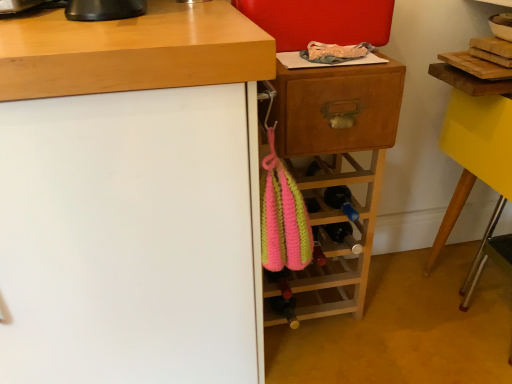
Locate an element on the screen. Image resolution: width=512 pixels, height=384 pixels. vacant area on top of wooden drawer at upper right (from a real-world perspective) is located at coordinates (333, 52).